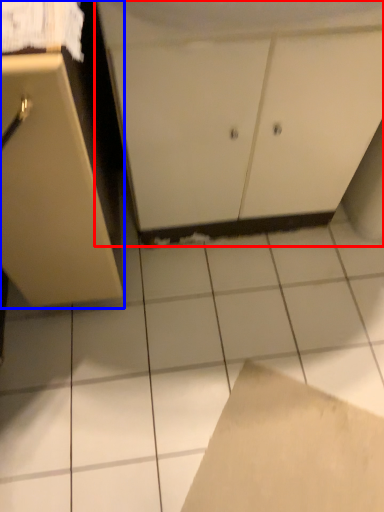
Question: Among these objects, which one is nearest to the camera, cabinetry (highlighted by a red box) or cabinetry (highlighted by a blue box)?

Choices:
 (A) cabinetry
 (B) cabinetry

Answer: (B)